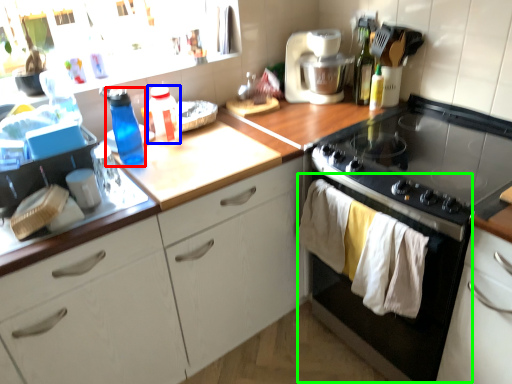
Question: Considering the real-world distances, which object is closest to bottle (highlighted by a red box)? bottle (highlighted by a blue box) or oven (highlighted by a green box).

Choices:
 (A) bottle
 (B) oven

Answer: (A)